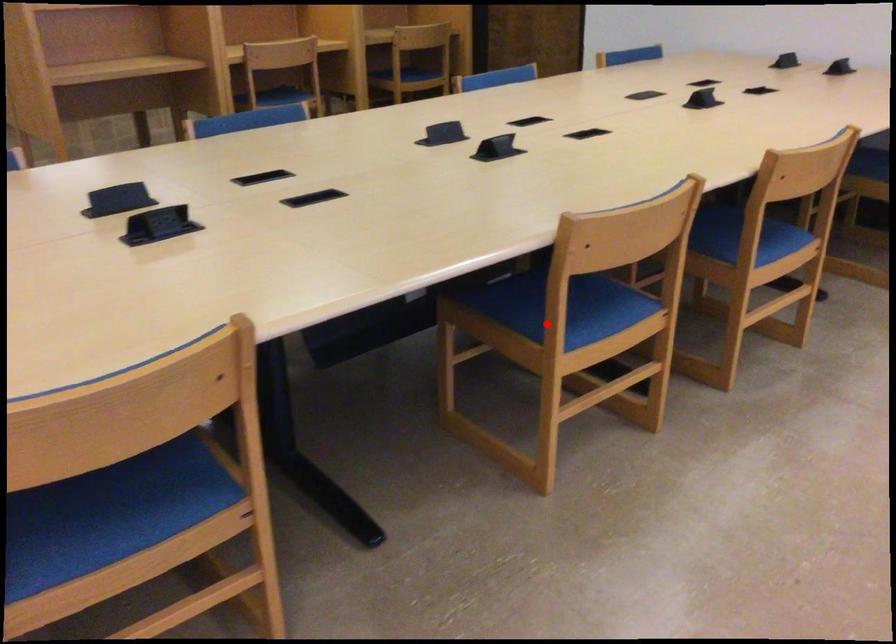
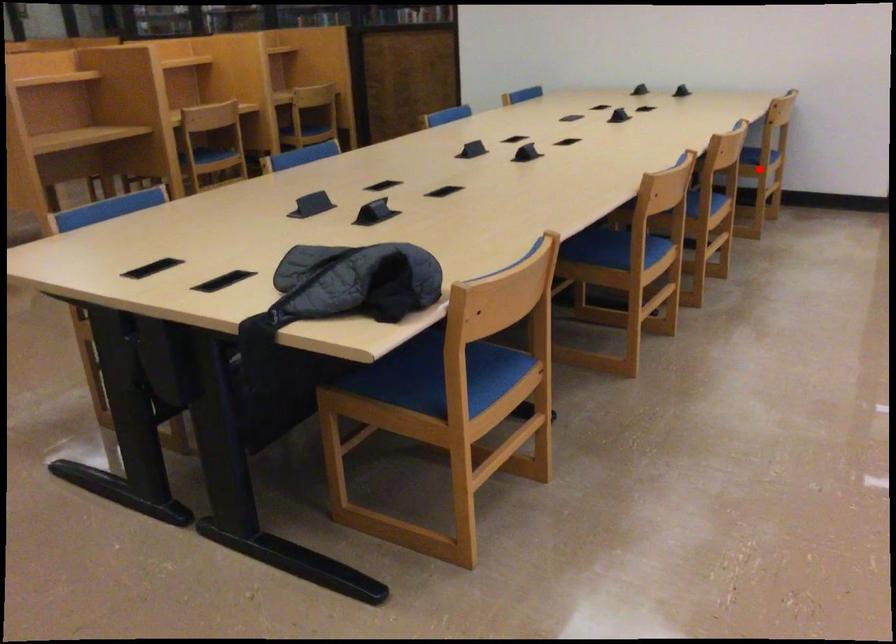
I am providing you with two images of the same scene from different viewpoints. A red point is marked on the first image and another point is marked on the second image. Are the points marked in image1 and image2 representing the same 3D position?

No